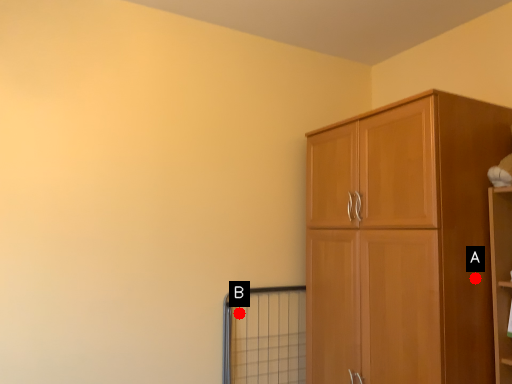
Question: Two points are circled on the image, labeled by A and B beside each circle. Which point appears farthest from the camera in this image?

Choices:
 (A) A is further
 (B) B is further

Answer: (B)